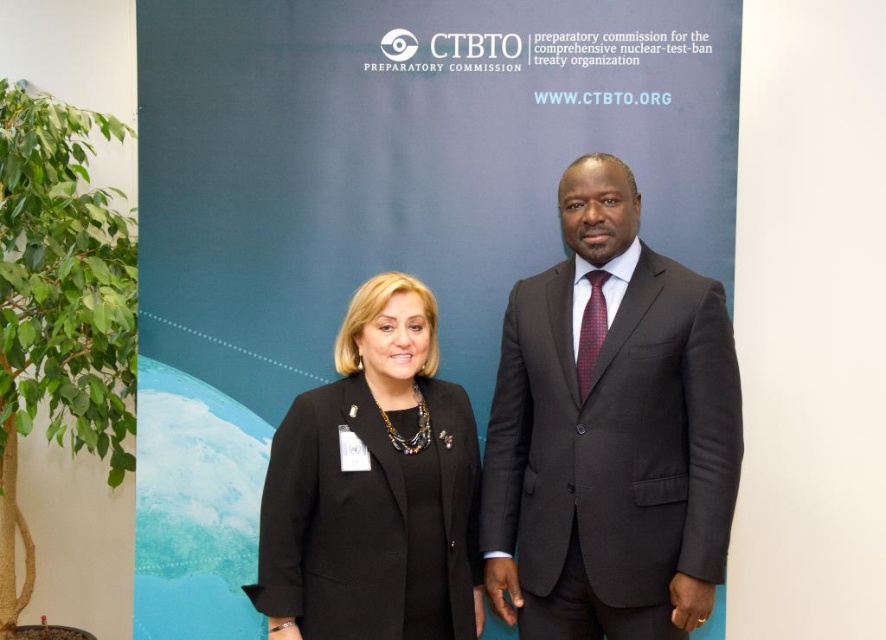
Question: Considering the real-world distances, which object is closest to the blue fabric banner at center?

Choices:
 (A) black fabric jacket at center
 (B) dark gray suit at center

Answer: (A)

Question: Which object appears closest to the camera in this image?

Choices:
 (A) black fabric jacket at center
 (B) blue fabric banner at center

Answer: (A)

Question: Is blue fabric banner at center wider than black fabric jacket at center?

Choices:
 (A) no
 (B) yes

Answer: (B)

Question: Is blue fabric banner at center bigger than dark gray suit at center?

Choices:
 (A) no
 (B) yes

Answer: (B)

Question: Which of the following is the farthest from the observer?

Choices:
 (A) (549, 285)
 (B) (581, 84)
 (C) (381, 448)

Answer: (B)

Question: Is dark gray suit at center above black fabric jacket at center?

Choices:
 (A) yes
 (B) no

Answer: (A)